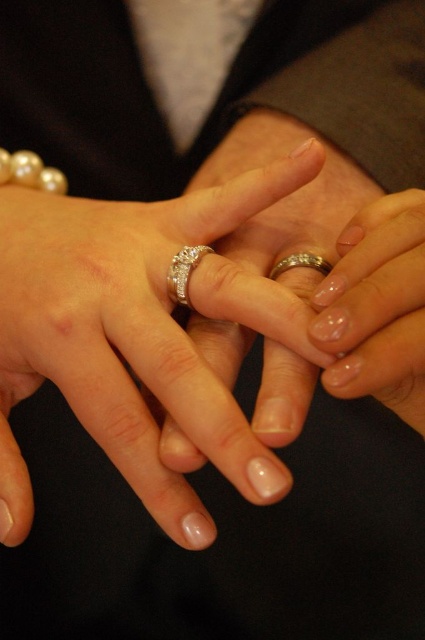
Is matte silver ring at center positioned at the back of diamond encrusted ring at center?

No, matte silver ring at center is in front of diamond encrusted ring at center.

Who is more forward, (90, 429) or (187, 264)?

Positioned in front is point (90, 429).

Image resolution: width=425 pixels, height=640 pixels. Describe the element at coordinates (127, 339) in the screenshot. I see `matte silver ring at center` at that location.

This screenshot has height=640, width=425. I want to click on matte silver ring at center, so click(127, 339).

Can you confirm if matte silver ring at center is thinner than clear acrylic nails at center?

No, matte silver ring at center is not thinner than clear acrylic nails at center.

Find the location of a particular element. This screenshot has width=425, height=640. matte silver ring at center is located at coordinates (127, 339).

Which is more to the right, clear acrylic nails at center or diamond encrusted ring at center?

From the viewer's perspective, clear acrylic nails at center appears more on the right side.

Is point (370, 273) positioned in front of point (195, 253)?

Yes.

Find the location of a particular element. Image resolution: width=425 pixels, height=640 pixels. clear acrylic nails at center is located at coordinates (377, 307).